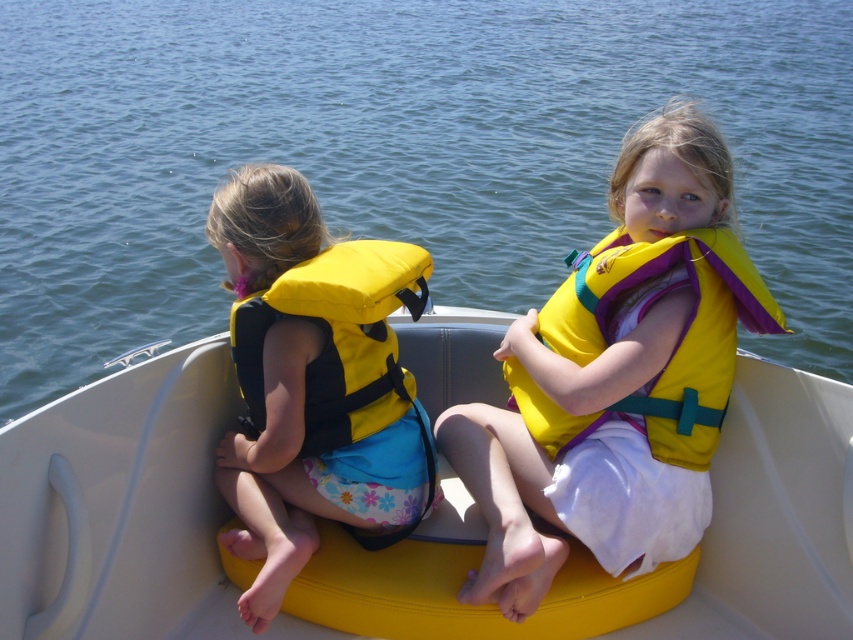
You are a lifeguard observing the scene. There is a point at coordinates (x=308, y=394). Based on the description of the yellow fabric life vest at left, can you determine if this point is located on the life vest?

The point (x=308, y=394) marks the yellow fabric life vest at left, so yes, the point is located on the life vest.

Consider the image. You are a photographer trying to capture a closeup of the yellow fabric life vest at center and the yellow fabric life jacket at center. Which one will appear larger in your photo?

The yellow fabric life vest at center will appear larger in the photo because it is closer to the viewer than the yellow fabric life jacket at center.